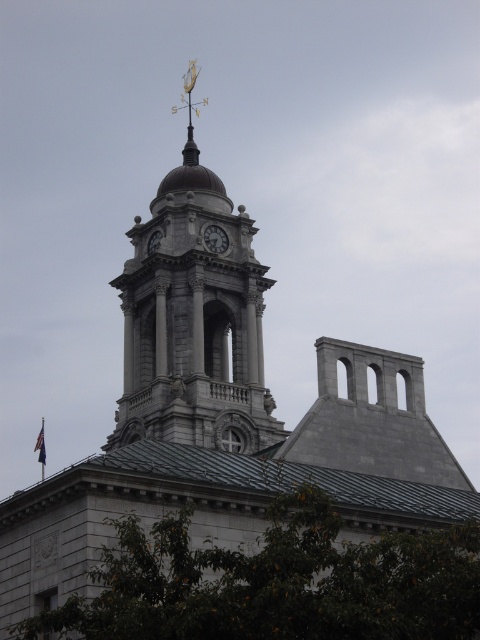
You are standing at the base of the clock tower in the historic building. You see a point marked at coordinates (276, 582). Based on the scene, where is this point located?

The point at coordinates (276, 582) is located on the green leafy tree at lower center.

You are standing in front of the historic building and want to take a photo of the gray stone clock tower at center. However, there is a green leafy tree at lower center blocking your view. Can you determine if the tree is shorter than the clock tower?

The green leafy tree at lower center is not as tall as the gray stone clock tower at center, so yes, the tree is shorter than the clock tower and might not fully block the view depending on its position.